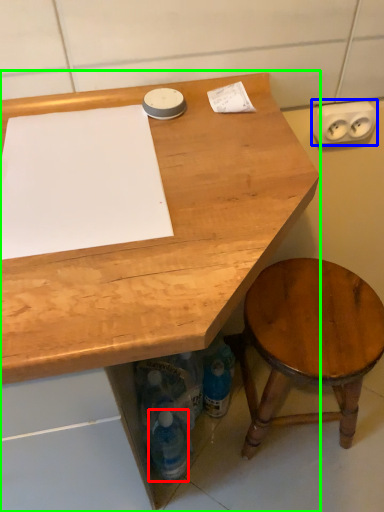
Question: Based on their relative distances, which object is nearer to bottle (highlighted by a red box)? Choose from electric outlet (highlighted by a blue box) and desk (highlighted by a green box).

Choices:
 (A) electric outlet
 (B) desk

Answer: (B)